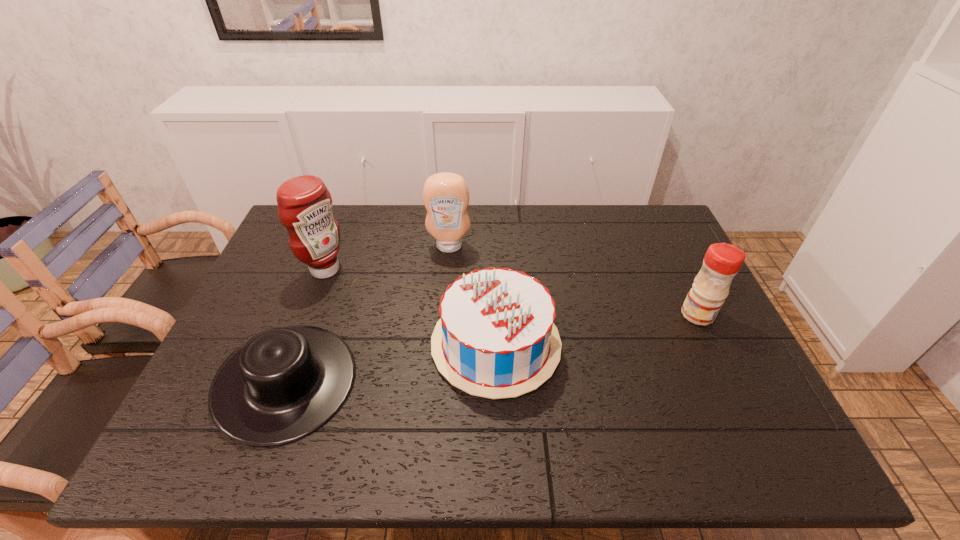
Locate an element on the screen. the leftmost condiment is located at coordinates 305,204.

Identify the location of the second farthest condiment. The height and width of the screenshot is (540, 960). coord(305,204).

At what (x,y) coordinates should I click in order to perform the action: click on the second condiment from left to right. Please return your answer as a coordinate pair (x, y). This screenshot has width=960, height=540. Looking at the image, I should click on (446, 196).

Locate an element on the screen. the farthest condiment is located at coordinates (446, 196).

The height and width of the screenshot is (540, 960). Identify the location of the nearest condiment. (722, 261).

In order to click on the rightmost object in this screenshot , I will do `click(722, 261)`.

At what (x,y) coordinates should I click in order to perform the action: click on birthday cake. Please return your answer as a coordinate pair (x, y). This screenshot has height=540, width=960. Looking at the image, I should click on (496, 339).

Find the location of a particular element. the shortest object is located at coordinates 285,383.

Image resolution: width=960 pixels, height=540 pixels. Find the location of `vacant area situated 0.110m on the back of the leftmost condiment`. vacant area situated 0.110m on the back of the leftmost condiment is located at coordinates (339, 234).

Where is `vacant space located on the label of the farthest object`? This screenshot has width=960, height=540. vacant space located on the label of the farthest object is located at coordinates (444, 310).